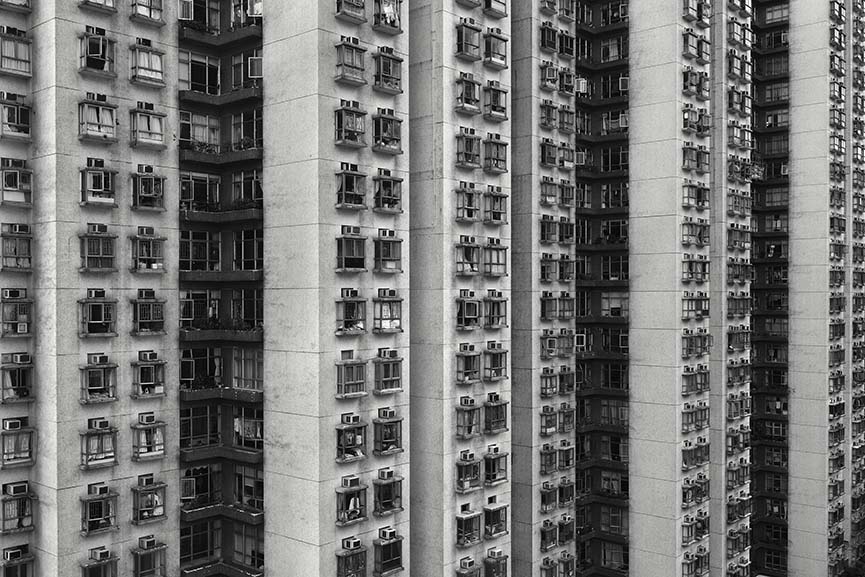
Image resolution: width=865 pixels, height=577 pixels. Identify the location of window unit farthest bottom left in image. (11, 571).